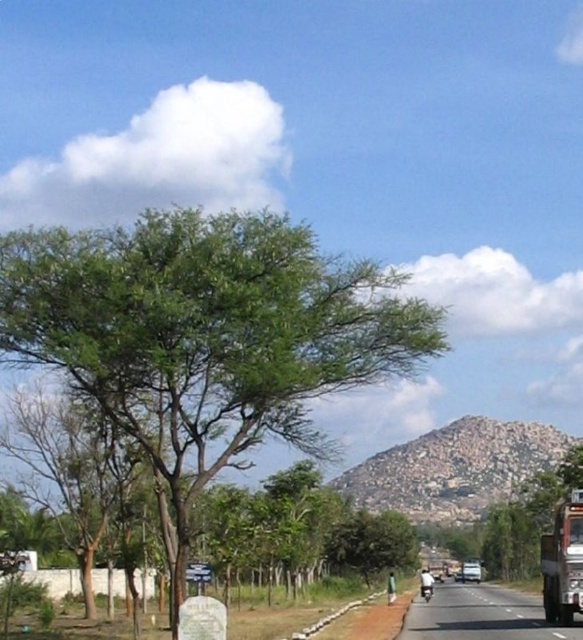
Is green leafy tree at center shorter than metallic silver trailer truck at right?

Correct, green leafy tree at center is not as tall as metallic silver trailer truck at right.

Does green leafy tree at center have a greater height compared to metallic silver trailer truck at right?

No, green leafy tree at center is not taller than metallic silver trailer truck at right.

Is point (94, 298) positioned before point (560, 620)?

Yes, it is.

Find the location of `green leafy tree at center`. green leafy tree at center is located at coordinates coord(205,336).

Is point (466, 595) farther from camera compared to point (577, 600)?

Yes.

Can you confirm if black asphalt road at center is taller than metallic silver trailer truck at right?

No, black asphalt road at center is not taller than metallic silver trailer truck at right.

Does point (440, 584) come behind point (539, 552)?

No, it is in front of (539, 552).

Find the location of a particular element. The image size is (583, 640). black asphalt road at center is located at coordinates (480, 616).

Which is more to the right, green leafy tree at center or black asphalt road at center?

black asphalt road at center is more to the right.

Is point (135, 266) behind point (525, 628)?

No, it is in front of (525, 628).

Locate an element on the screen. The height and width of the screenshot is (640, 583). green leafy tree at center is located at coordinates (205, 336).